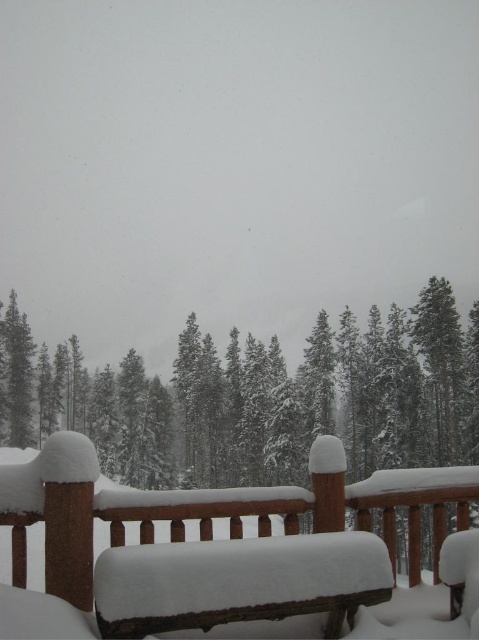
You are standing on the wooden deck and want to place a small potted plant exactly at the point (x=273, y=618). Considering the snow coverage on the deck, is this location safe and clear of snow?

The point (x=273, y=618) is 9.26 feet from the viewer, so placing the potted plant there would be safe as it is likely clear of snow since the snow is mentioned to be on the bench and railing but not explicitly on the deck itself.